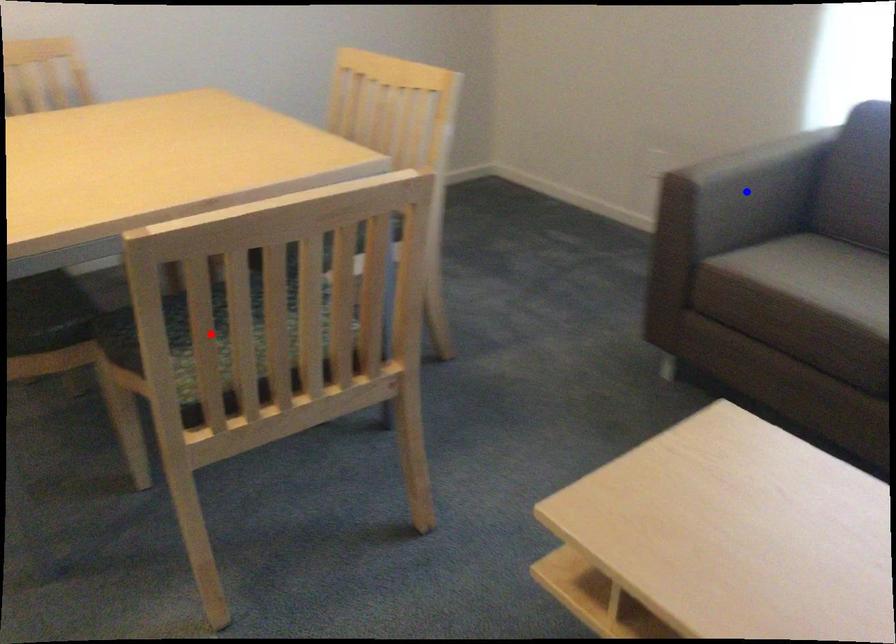
Question: Two points are marked on the image. Which point is closer to the camera?

Choices:
 (A) Blue point is closer.
 (B) Red point is closer.

Answer: (B)